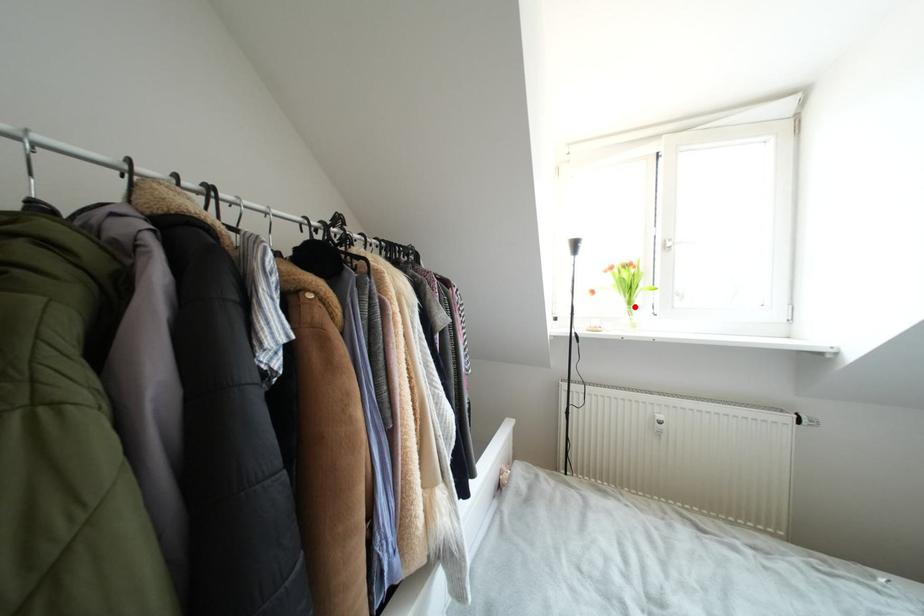
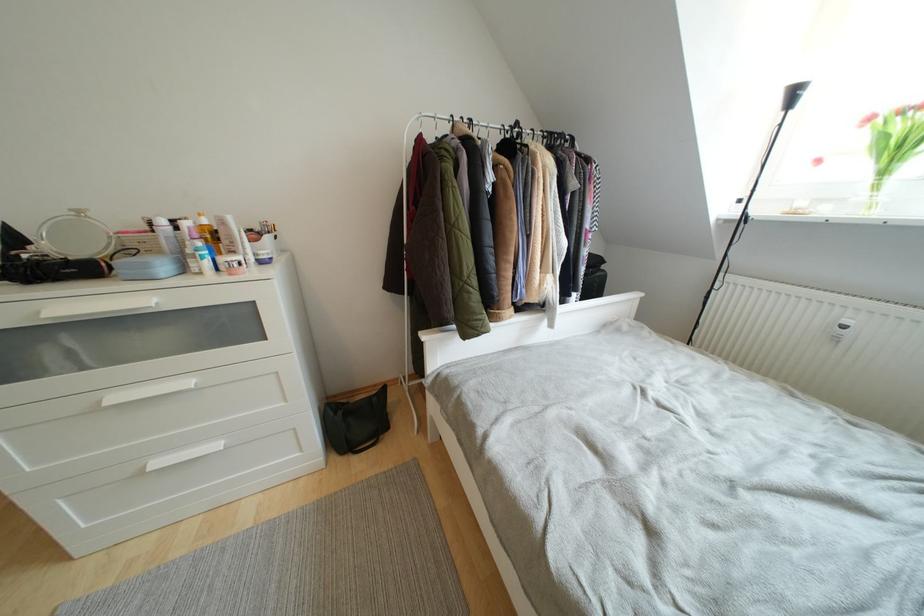
Locate, in the second image, the point that corresponds to the highlighted location in the first image.

(890, 176)